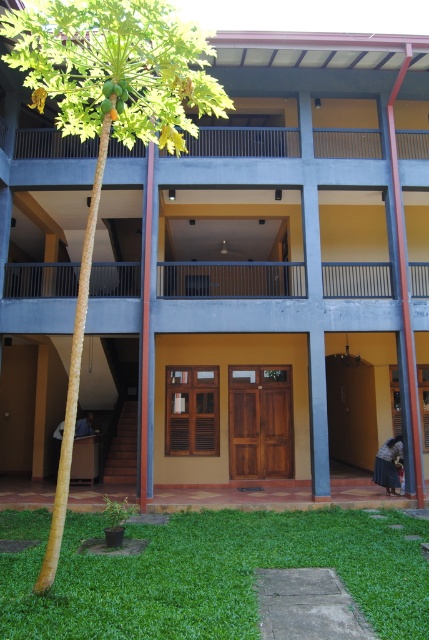
Question: Estimate the real-world distances between objects in this image. Which object is farther from the black metal balcony at center?

Choices:
 (A) green grass at lower center
 (B) green leafy tree at upper left
 (C) brown wooden balcony at upper center

Answer: (A)

Question: Is green leafy tree at upper left closer to the viewer compared to black metal balcony at center?

Choices:
 (A) no
 (B) yes

Answer: (B)

Question: Is green leafy tree at upper left below brown wooden balcony at upper center?

Choices:
 (A) no
 (B) yes

Answer: (B)

Question: Which of the following is the farthest from the observer?

Choices:
 (A) (130, 83)
 (B) (211, 152)
 (C) (21, 285)

Answer: (B)

Question: Is green grass at lower center positioned at the back of black metal balcony at center?

Choices:
 (A) no
 (B) yes

Answer: (A)

Question: Estimate the real-world distances between objects in this image. Which object is closer to the black metal balcony at center?

Choices:
 (A) green leafy tree at upper left
 (B) brown wooden balcony at upper center
 (C) green grass at lower center

Answer: (B)